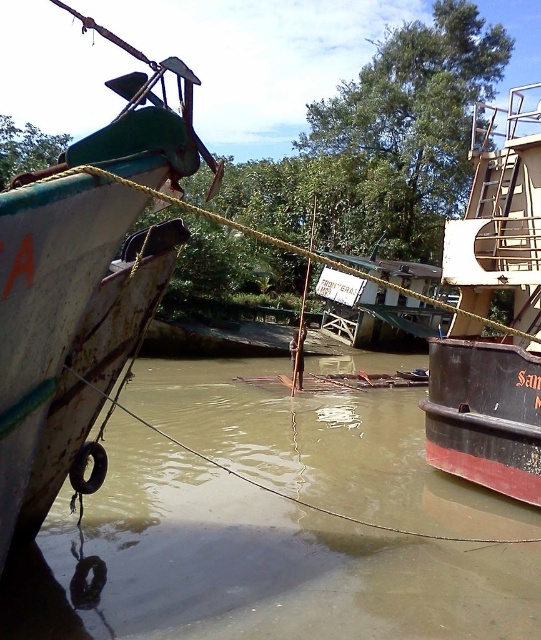
Between point (49, 296) and point (524, 326), which one is positioned behind?

The point (524, 326) is behind.

This screenshot has height=640, width=541. I want to click on rusty metal boat at left, so click(x=83, y=282).

Image resolution: width=541 pixels, height=640 pixels. What do you see at coordinates (247, 564) in the screenshot?
I see `brown matte water at center` at bounding box center [247, 564].

Which of these two, brown matte water at center or rusty metal boat at right, stands taller?

rusty metal boat at right

Between point (372, 492) and point (451, 240), which one is positioned in front?

Point (372, 492) is in front.

This screenshot has width=541, height=640. I want to click on brown matte water at center, so click(x=247, y=564).

Can you confirm if brown matte water at center is positioned to the left of rusty metal boat at left?

In fact, brown matte water at center is to the right of rusty metal boat at left.

Is brown matte water at center to the right of rusty metal boat at left from the viewer's perspective?

Correct, you'll find brown matte water at center to the right of rusty metal boat at left.

Does point (337, 454) lie in front of point (174, 253)?

No, it is behind (174, 253).

Identify the location of brown matte water at center. The image size is (541, 640). (247, 564).